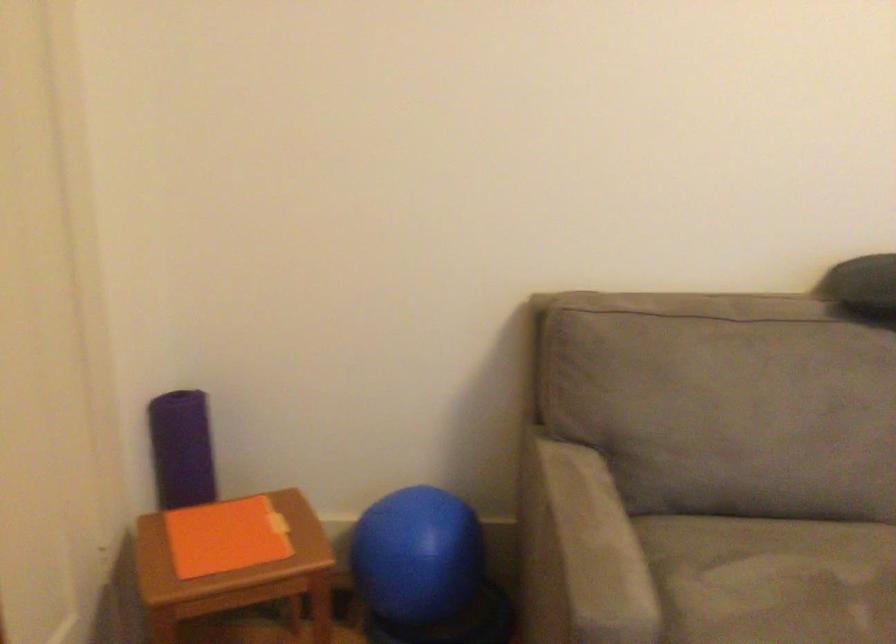
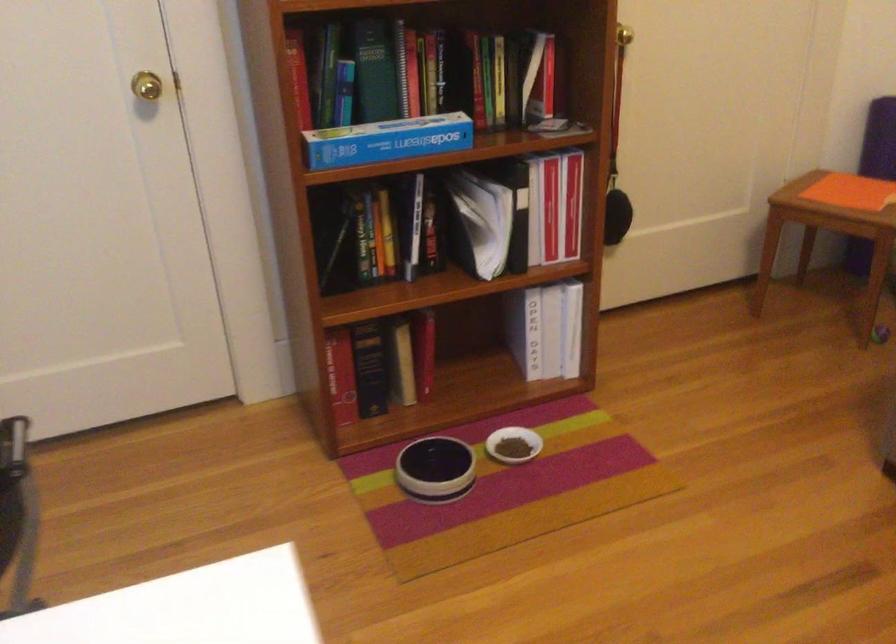
The point at (246, 550) is marked in the first image. Where is the corresponding point in the second image?

(840, 196)